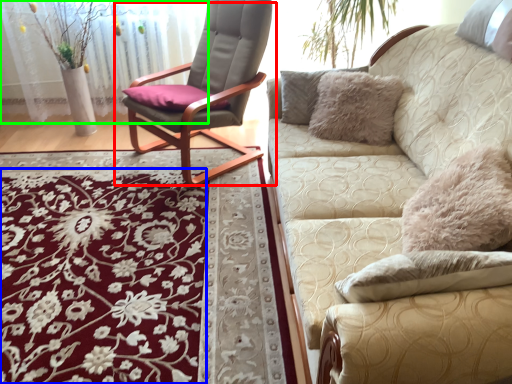
Question: Based on their relative distances, which object is farther from chair (highlighted by a red box)? Choose from flower (highlighted by a blue box) and glass door (highlighted by a green box).

Choices:
 (A) flower
 (B) glass door

Answer: (A)